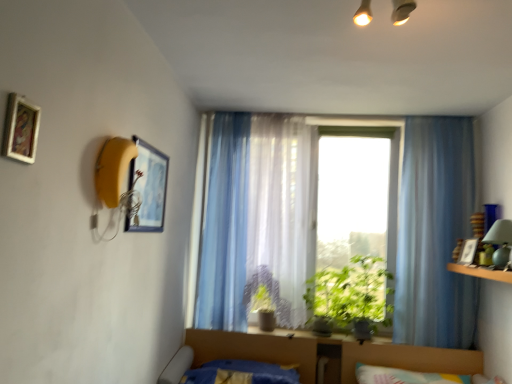
Question: Considering the positions of matte black picture frame at upper left, the 2th picture frame from the back, and translucent fabric window at center in the image, is matte black picture frame at upper left, the 2th picture frame from the back, taller or shorter than translucent fabric window at center?

Choices:
 (A) tall
 (B) short

Answer: (B)

Question: From the image's perspective, is matte black picture frame at upper left, the 2th picture frame from the back, above or below translucent fabric window at center?

Choices:
 (A) below
 (B) above

Answer: (B)

Question: Which is farther from the green leafy plant at center?

Choices:
 (A) green leafy plant at center, the 1th plant in the right-to-left sequence
 (B) white matte picture frame at right, the third picture frame positioned from the front
 (C) wooden framed painting at upper left, acting as the 1th picture frame starting from the top
 (D) wooden shelf at right
 (E) translucent fabric curtain at center, acting as the 2th curtain starting from the right

Answer: (C)

Question: Considering the real-world distances, which object is closest to the blue plush bed at lower center?

Choices:
 (A) translucent fabric curtain at center, the 3th curtain positioned from the right
 (B) green leafy plant at center
 (C) translucent fabric window at center
 (D) matte black picture frame at upper left, the second picture frame when ordered from bottom to top
 (E) green leafy plant at center, placed as the 2th plant when sorted from left to right

Answer: (A)